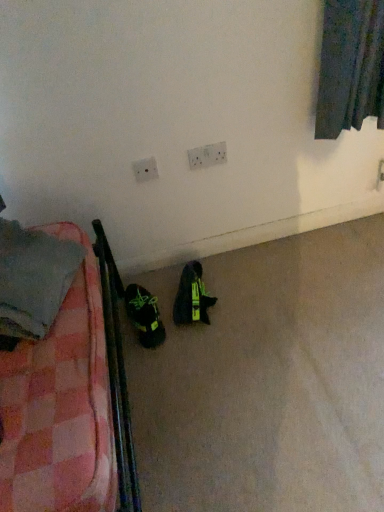
The width and height of the screenshot is (384, 512). I want to click on vacant position to the left of green synthetic shoe at center, which appears as the second footwear when viewed from the left, so click(x=148, y=294).